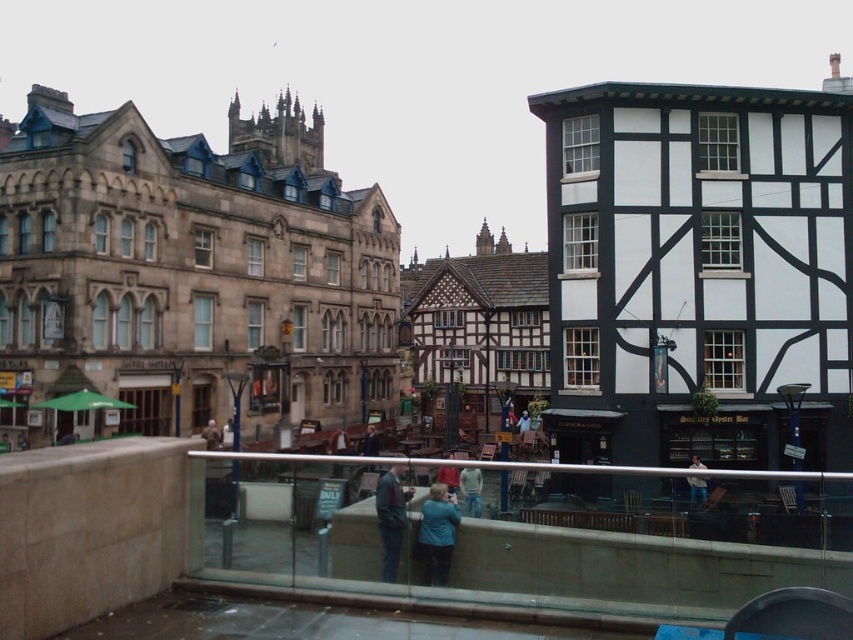
Question: Based on their relative distances, which object is farther from the blue fabric jacket at center?

Choices:
 (A) white cotton shirt at center
 (B) blue denim jacket at center
 (C) light blue denim jeans at center
 (D) light brown leather jacket at center

Answer: (B)

Question: Is denim pants at lower center closer to camera compared to blue denim jacket at center?

Choices:
 (A) no
 (B) yes

Answer: (B)

Question: Which point is closer to the camera?

Choices:
 (A) (705, 484)
 (B) (519, 428)
 (C) (212, 428)

Answer: (A)

Question: Among these points, which one is nearest to the camera?

Choices:
 (A) (529, 429)
 (B) (428, 573)
 (C) (695, 480)
 (D) (213, 449)

Answer: (C)

Question: Does blue fabric jacket at center have a lesser width compared to blue denim jacket at center?

Choices:
 (A) yes
 (B) no

Answer: (A)

Question: Does denim pants at lower center appear under white cotton shirt at center?

Choices:
 (A) no
 (B) yes

Answer: (B)